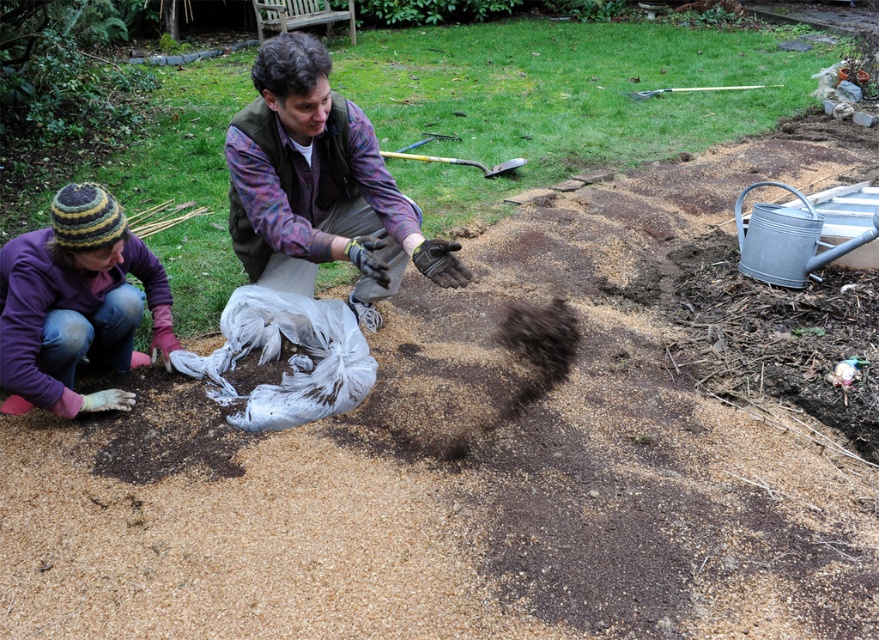
You are a delivery person who needs to place a package between the flannel shirt at center and the metallic silver shovel at upper center. The package requires 2 meters of space. Can you fit it between them?

The flannel shirt at center and metallic silver shovel at upper center are 3.04 meters apart from each other, so yes, the package requiring 2 meters of space can fit between them since the distance is sufficient.